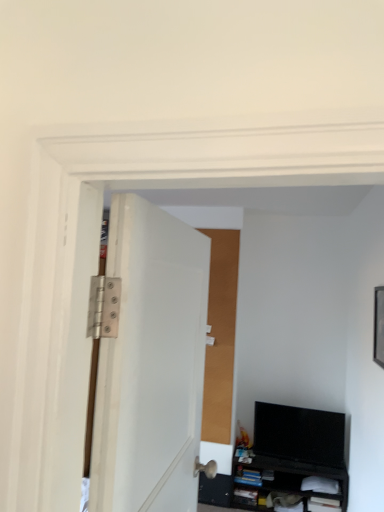
Question: Does black matte cabinet at lower right have a greater width compared to white matte door at center?

Choices:
 (A) no
 (B) yes

Answer: (B)

Question: Considering the relative positions of black matte cabinet at lower right and white matte door at center in the image provided, is black matte cabinet at lower right behind white matte door at center?

Choices:
 (A) no
 (B) yes

Answer: (B)

Question: Is the position of black matte cabinet at lower right less distant than that of white matte door at center?

Choices:
 (A) no
 (B) yes

Answer: (A)

Question: From the image's perspective, is black matte cabinet at lower right on white matte door at center?

Choices:
 (A) yes
 (B) no

Answer: (B)

Question: Is black matte cabinet at lower right bigger than white matte door at center?

Choices:
 (A) yes
 (B) no

Answer: (A)

Question: From their relative heights in the image, would you say black matte cabinet at lower right is taller or shorter than white matte door at center?

Choices:
 (A) tall
 (B) short

Answer: (B)

Question: Considering their positions, is black matte cabinet at lower right located in front of or behind white matte door at center?

Choices:
 (A) front
 (B) behind

Answer: (B)

Question: Would you say black matte cabinet at lower right is to the left or to the right of white matte door at center in the picture?

Choices:
 (A) left
 (B) right

Answer: (B)

Question: Is black matte cabinet at lower right wider or thinner than white matte door at center?

Choices:
 (A) wide
 (B) thin

Answer: (A)

Question: Based on their sizes in the image, would you say black glossy tv at lower right is bigger or smaller than white matte door at center?

Choices:
 (A) small
 (B) big

Answer: (A)

Question: Looking at their shapes, would you say black glossy tv at lower right is wider or thinner than white matte door at center?

Choices:
 (A) thin
 (B) wide

Answer: (A)

Question: Would you say black glossy tv at lower right is inside or outside white matte door at center?

Choices:
 (A) inside
 (B) outside

Answer: (B)

Question: From a real-world perspective, is black glossy tv at lower right physically located above or below white matte door at center?

Choices:
 (A) above
 (B) below

Answer: (B)

Question: Is point (294, 425) closer or farther from the camera than point (332, 475)?

Choices:
 (A) farther
 (B) closer

Answer: (A)

Question: In the image, is black glossy tv at lower right positioned in front of or behind black matte cabinet at lower right?

Choices:
 (A) behind
 (B) front

Answer: (A)